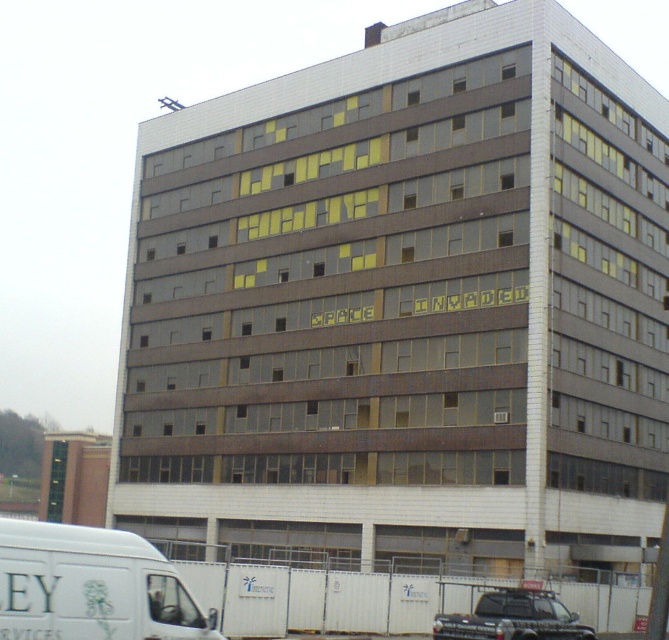
From the picture: You are standing in front of the building and want to take a photo. There are two points on the building you want to capture clearly. The first point is at coordinates point (130, 632) and the second is point (504, 614). Since you can only focus on one point clearly at a time, which point should you focus on to ensure it appears sharp in the photo?

You should focus on point (130, 632) because it is closer to the camera and will be in focus, while the other point will be slightly out of focus due to its greater distance from the camera.

You are a delivery driver who needs to park your vehicle between the white matte van at lower left and the black matte truck at lower right. The parking spot between them is exactly 34.91 feet long. Your delivery truck is 35 feet long. Can you fit your truck into the space between them without needing to adjust the position of either vehicle?

The parking spot between the white matte van at lower left and the black matte truck at lower right is 34.91 feet long, which is slightly shorter than your 35 feet long delivery truck. Therefore, you cannot fit your truck into the space without adjusting the position of either vehicle.